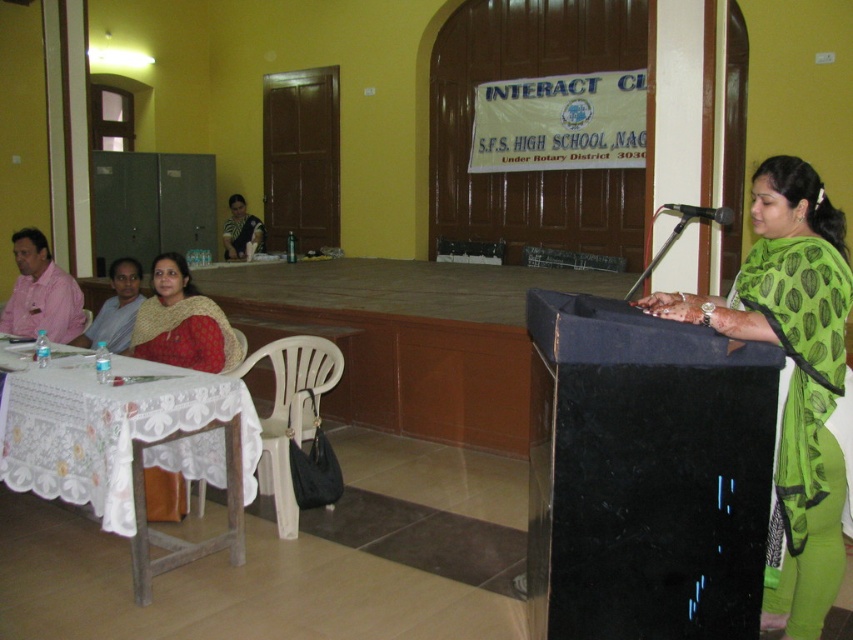
Question: Which point appears closest to the camera in this image?

Choices:
 (A) (247, 241)
 (B) (61, 280)
 (C) (97, 433)

Answer: (C)

Question: Considering the relative positions of white lace tablecloth at lower left and white textured sweater at upper left in the image provided, where is white lace tablecloth at lower left located with respect to white textured sweater at upper left?

Choices:
 (A) right
 (B) left

Answer: (A)

Question: Is green silk saree at center positioned before matte beige sweater at lower left?

Choices:
 (A) yes
 (B) no

Answer: (A)

Question: Among these points, which one is nearest to the camera?

Choices:
 (A) (166, 275)
 (B) (231, 220)
 (C) (55, 298)

Answer: (A)

Question: Which of the following is the farthest from the observer?

Choices:
 (A) (239, 250)
 (B) (187, 349)

Answer: (A)

Question: Can you confirm if green silk saree at center is wider than matte pink shirt at left?

Choices:
 (A) no
 (B) yes

Answer: (B)